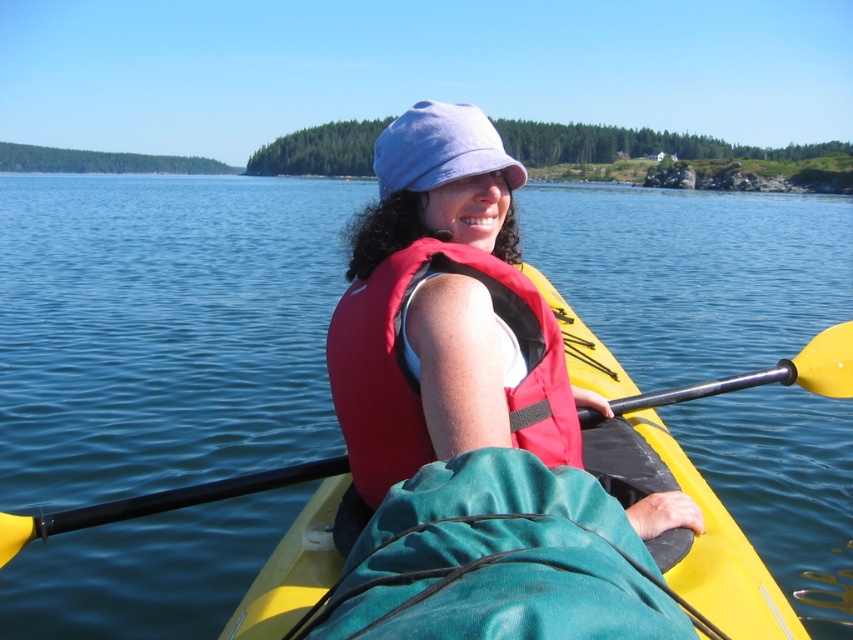
Question: Which point appears farthest from the camera in this image?

Choices:
 (A) (303, 584)
 (B) (112, 480)
 (C) (370, 401)
 (D) (486, 145)

Answer: (B)

Question: Which of these objects is positioned closest to the red matte life jacket at center?

Choices:
 (A) matte red life vest at center
 (B) yellow plastic canoe at center

Answer: (A)

Question: Where is blue water at center located in relation to matte red life vest at center in the image?

Choices:
 (A) right
 (B) left

Answer: (B)

Question: Based on their relative distances, which object is nearer to the matte red life vest at center?

Choices:
 (A) red matte life jacket at center
 (B) yellow plastic canoe at center

Answer: (A)

Question: Observing the image, what is the correct spatial positioning of matte red life vest at center in reference to red matte life jacket at center?

Choices:
 (A) above
 (B) below

Answer: (A)

Question: Does blue water at center appear on the left side of matte red life vest at center?

Choices:
 (A) no
 (B) yes

Answer: (B)